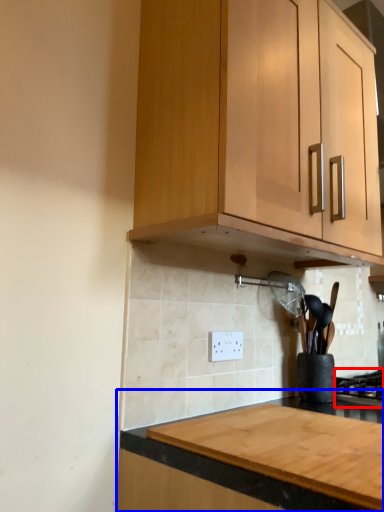
Question: Among these objects, which one is nearest to the camera, gas stove (highlighted by a red box) or countertop (highlighted by a blue box)?

Choices:
 (A) gas stove
 (B) countertop

Answer: (B)